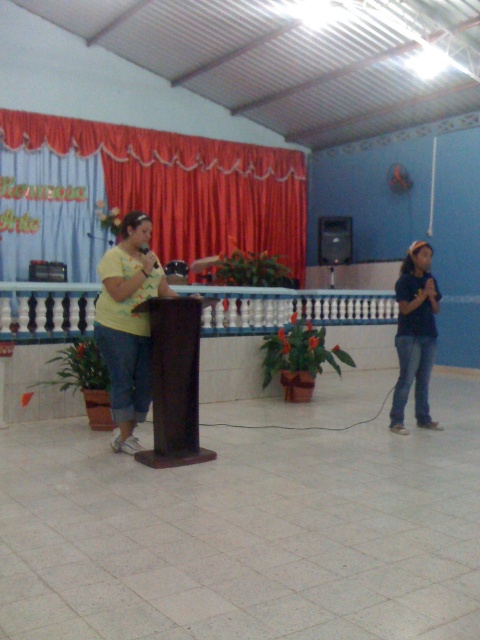
You are an event planner setting up a microphone stand. The stand can extend up to 6 feet. You need to place it between the yellow matte shirt at center and denim jeans at right. Will the stand be long enough to reach both positions?

The distance between the yellow matte shirt at center and denim jeans at right is 6.98 feet, which exceeds the microphone stand extension limit of 6 feet. Therefore, the stand will not be long enough to reach both positions.

You are organizing a small event and need to decide if the red velvet curtain at upper center can cover the denim jeans at right completely. Based on the image, can the curtain cover the jeans?

The red velvet curtain at upper center might be wider than denim jeans at right, so it could potentially cover them, but there is uncertainty due to the comparative size mentioned as a possibility.